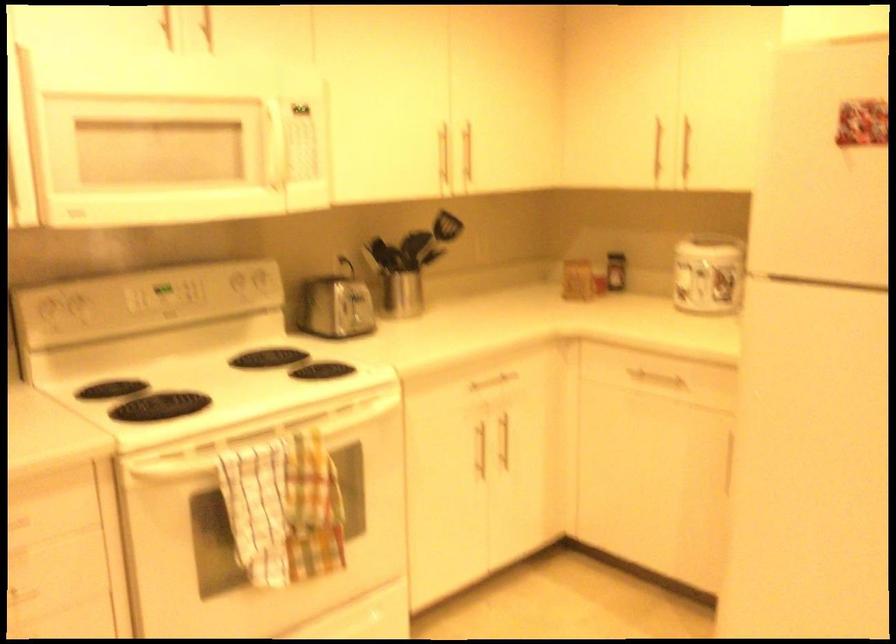
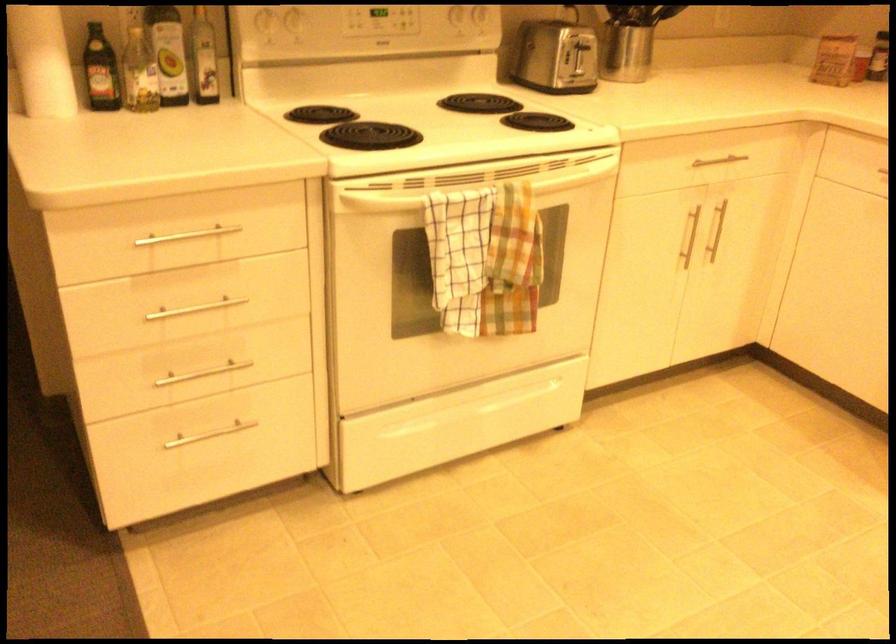
In the second image, find the point that corresponds to pixel 161 477 in the first image.

(374, 202)